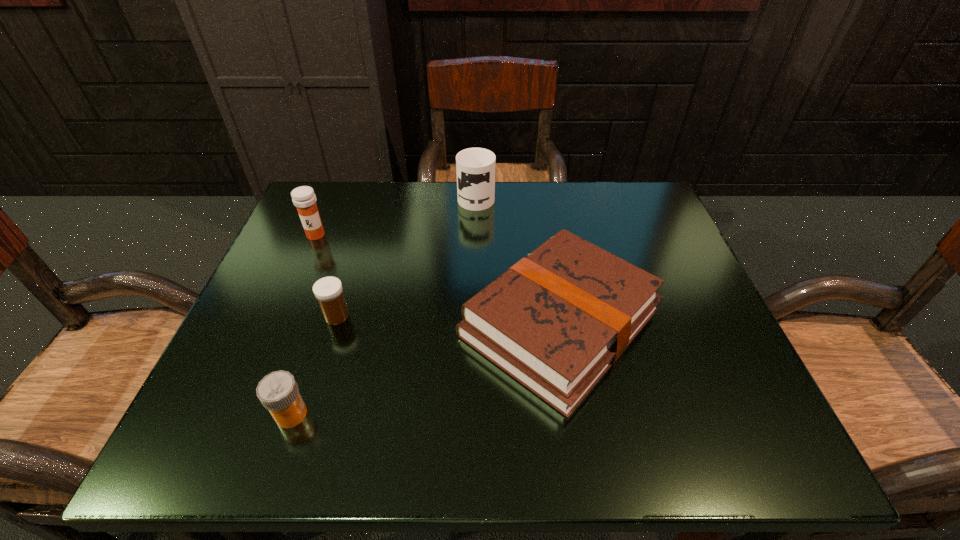
This screenshot has height=540, width=960. Identify the location of free space at the left edge. (270, 274).

In the image, there is a desktop. Identify the location of free space at the right edge. This screenshot has width=960, height=540. (702, 384).

I want to click on free region at the far left corner of the desktop, so click(x=296, y=232).

Find the location of a particular element. vacant space at the far right corner is located at coordinates (644, 193).

You are a GUI agent. You are given a task and a screenshot of the screen. Output one action in this format:
    pyautogui.click(x=<x>, y=<y>)
    Task: Click on the empty location between the nearest medicine and the farthest object
    
    Given the screenshot: What is the action you would take?
    pyautogui.click(x=384, y=305)

Locate an element on the screen. This screenshot has width=960, height=540. free space that is in between the second farthest medicine and the hardback book is located at coordinates (448, 319).

Find the location of a particular element. Image resolution: width=960 pixels, height=540 pixels. free space between the hardback book and the farthest object is located at coordinates (518, 259).

Where is `vacant area that lies between the hardback book and the mug`? The width and height of the screenshot is (960, 540). vacant area that lies between the hardback book and the mug is located at coordinates (518, 259).

Identify the location of vacant space in between the nearest medicine and the hardback book. (425, 368).

You are a GUI agent. You are given a task and a screenshot of the screen. Output one action in this format:
    pyautogui.click(x=<x>, y=<y>)
    Task: Click on the free space between the nearest medicine and the hardback book
    
    Given the screenshot: What is the action you would take?
    pyautogui.click(x=425, y=368)